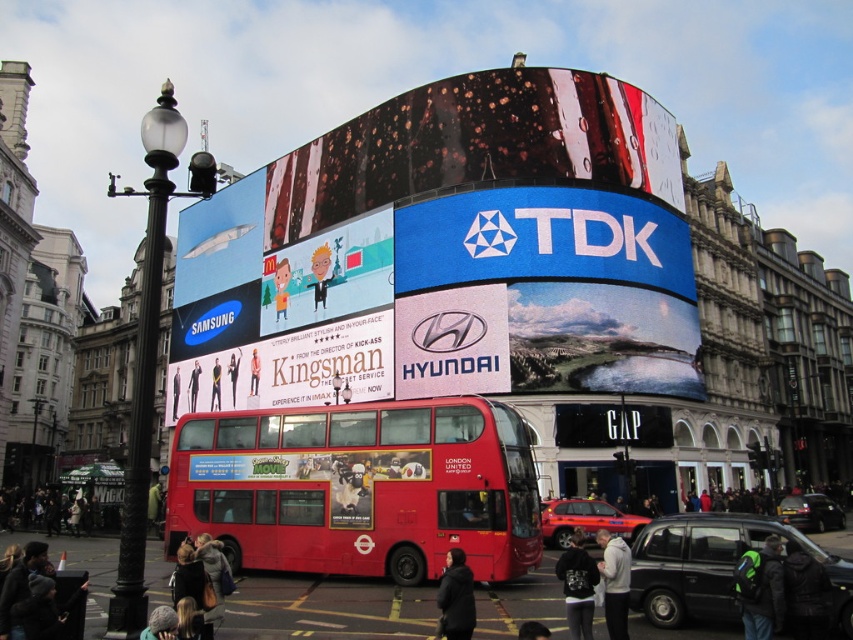
You are a tourist in London and see the image. You want to take a photo of the matte red bus at center. Where should you stand to ensure it fits in your camera frame? The camera has a field of view that can capture objects within a 1.5 meter radius from the center point. The point coordinates are given in normalized coordinates where the bottom left corner is the origin and the top right corner is 1.0. The point at (322, 476) is the center of the matte red bus at center. The camera is placed at the origin

To ensure the matte red bus at center fits within your camera frame, you should position yourself at the origin point. Since the camera has a field of view capturing a 1.5 meter radius around the center point at (322, 476), the bus will be within the frame as long as the distance from the origin to this point is less than 1.5 meters. However, without specific scale information, it is recommended to stand at the origin and adjust your position slightly to frame the bus properly.

You are standing in the middle of the urban scene and want to determine the relative positions of two points marked in the image. Which point is closer to you, point 1 at coordinates [412,454] or point 2 at coordinates [194,467]?

Point 1 at coordinates [412,454] is closer to the viewer than point 2 at coordinates [194,467].

You are a photographer standing in the middle of the street. You want to take a photo of the matte red bus at center and the dark brown hair at center. Which object should you focus on first to ensure both are in focus?

You should focus on the matte red bus at center first because it is closer to you than the dark brown hair at center, so focusing on it will ensure the dark brown hair at center is also in focus.